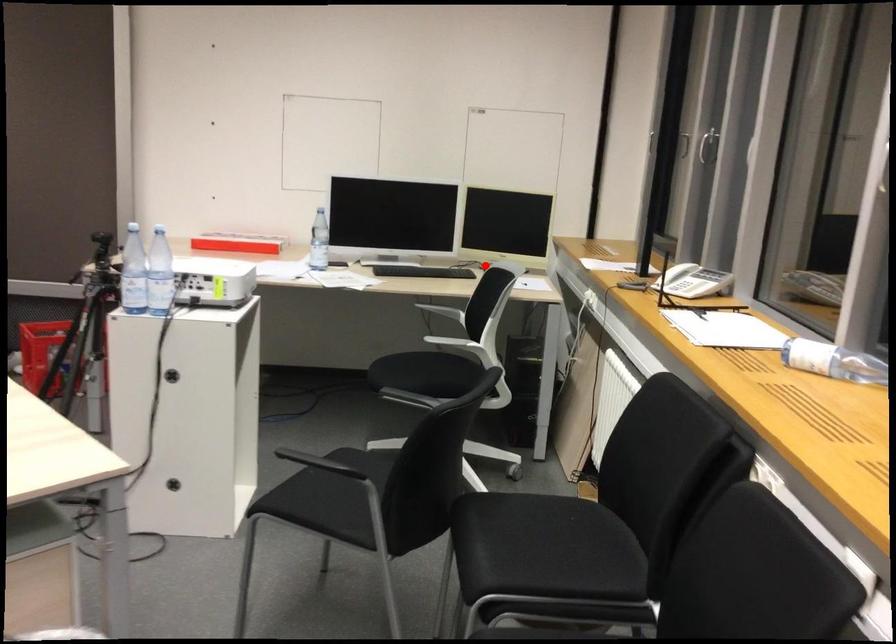
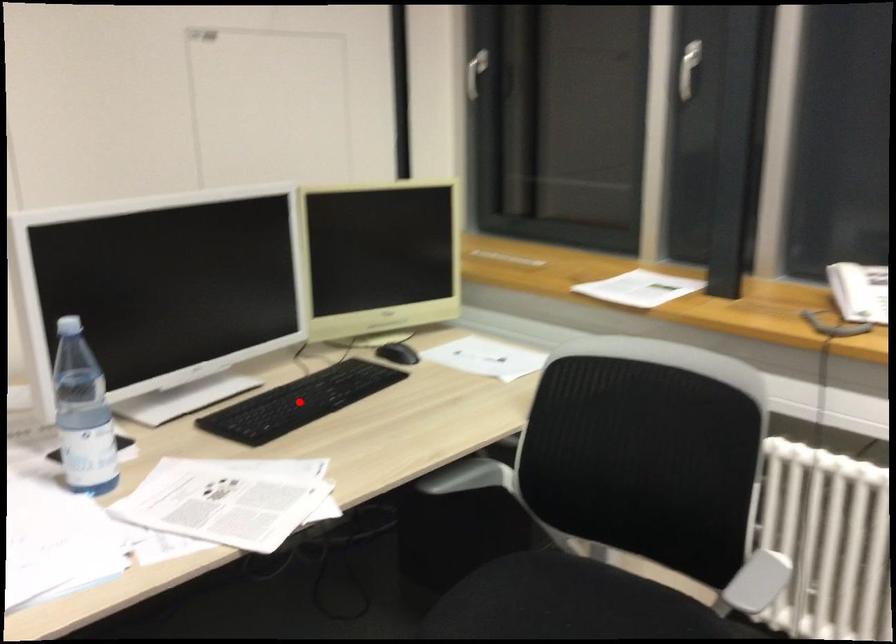
I am providing you with two images of the same scene from different viewpoints. A red point is marked on the first image and another point is marked on the second image. Is the red point in image1 aligned with the point shown in image2?

No